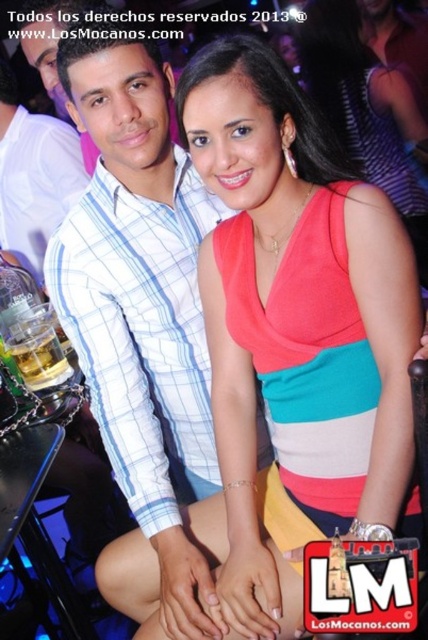
You are a photographer trying to capture a candid shot of the white checkered shirt at center and the translucent glass beer at lower left. Since the scene is dimly lit, you need to adjust your camera settings. Considering their heights, which object should you focus on first to ensure proper exposure?

The white checkered shirt at center has a greater height compared to the translucent glass beer at lower left, so you should focus on the white checkered shirt at center first to ensure proper exposure.

You are a photographer at the event and want to ensure both the white checkered shirt at center and the matte plaid shirt at left are clearly visible in your photo. Given their sizes, which shirt should you focus on to capture more details?

The white checkered shirt at center is larger in size compared to the matte plaid shirt at left, so focusing on it will allow you to capture more details.

You are a photographer trying to capture the scene. You notice the point at coordinates (x=33, y=177) in the image. What object is located at this point?

The point at coordinates (x=33, y=177) marks the matte plaid shirt at left.